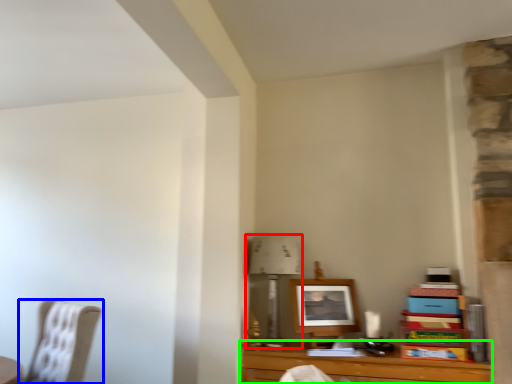
Question: Considering the real-world distances, which object is closest to table lamp (highlighted by a red box)? chair (highlighted by a blue box) or table (highlighted by a green box).

Choices:
 (A) chair
 (B) table

Answer: (B)